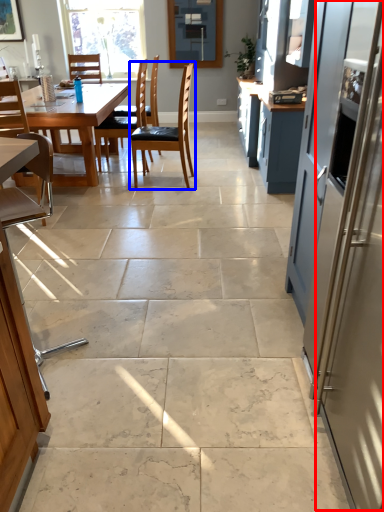
Question: Which object is further to the camera taking this photo, screen door (highlighted by a red box) or chair (highlighted by a blue box)?

Choices:
 (A) screen door
 (B) chair

Answer: (B)